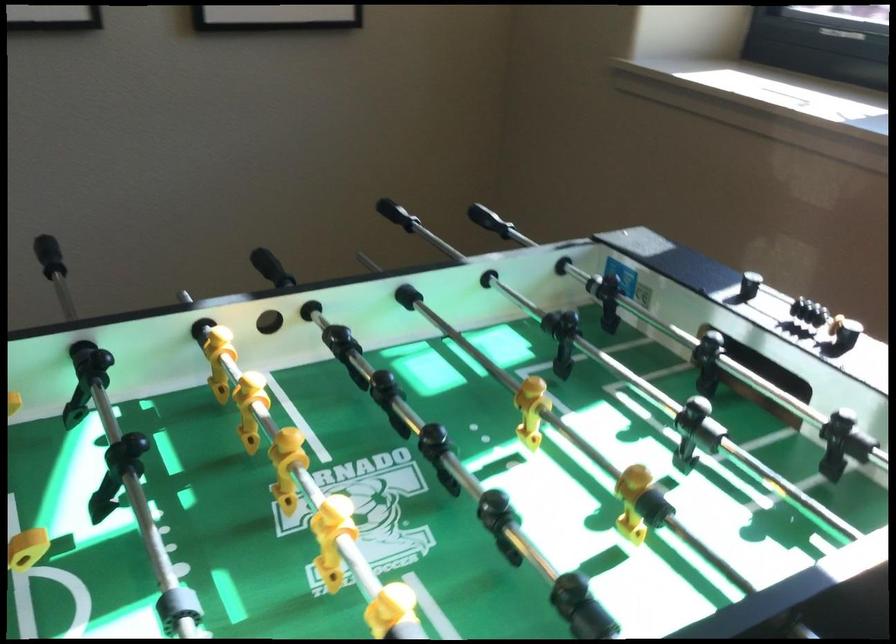
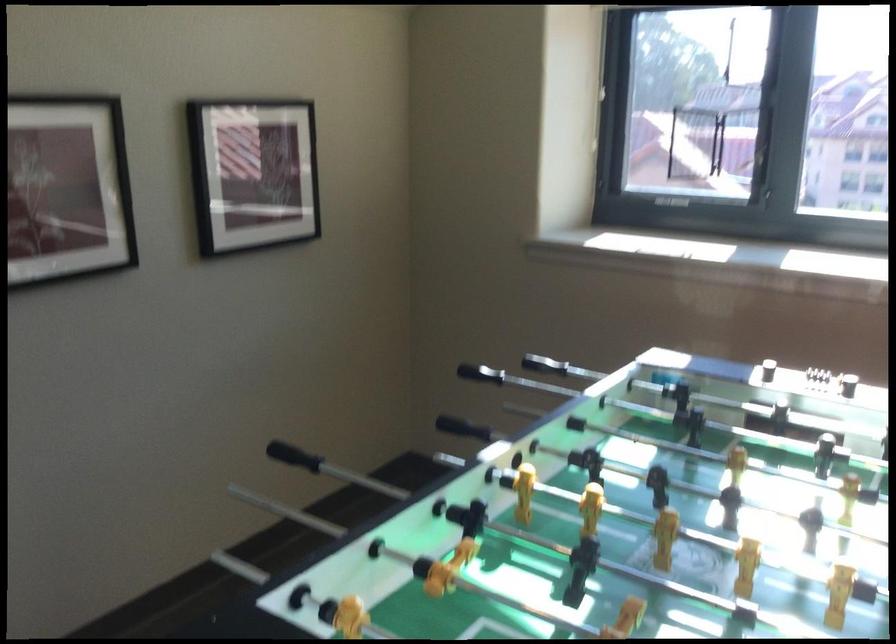
Find the pixel in the second image that matches the point at 548,230 in the first image.

(479, 373)